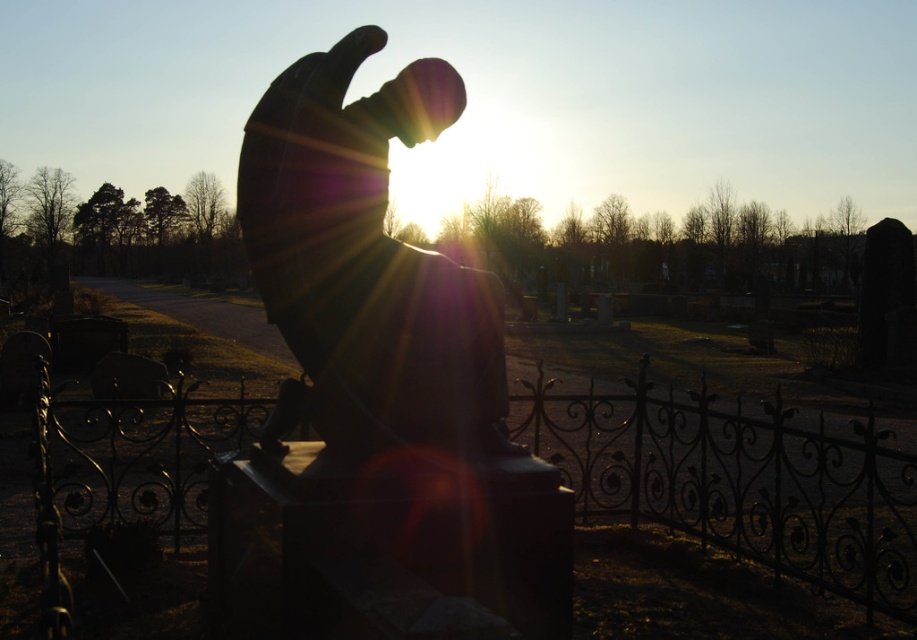
Does sculpted stone figure at center have a lesser height compared to black wrought iron fence at center?

In fact, sculpted stone figure at center may be taller than black wrought iron fence at center.

Can you confirm if sculpted stone figure at center is thinner than black wrought iron fence at center?

Indeed, sculpted stone figure at center has a lesser width compared to black wrought iron fence at center.

Describe the element at coordinates (378, 403) in the screenshot. I see `sculpted stone figure at center` at that location.

The width and height of the screenshot is (917, 640). Find the location of `sculpted stone figure at center`. sculpted stone figure at center is located at coordinates (378, 403).